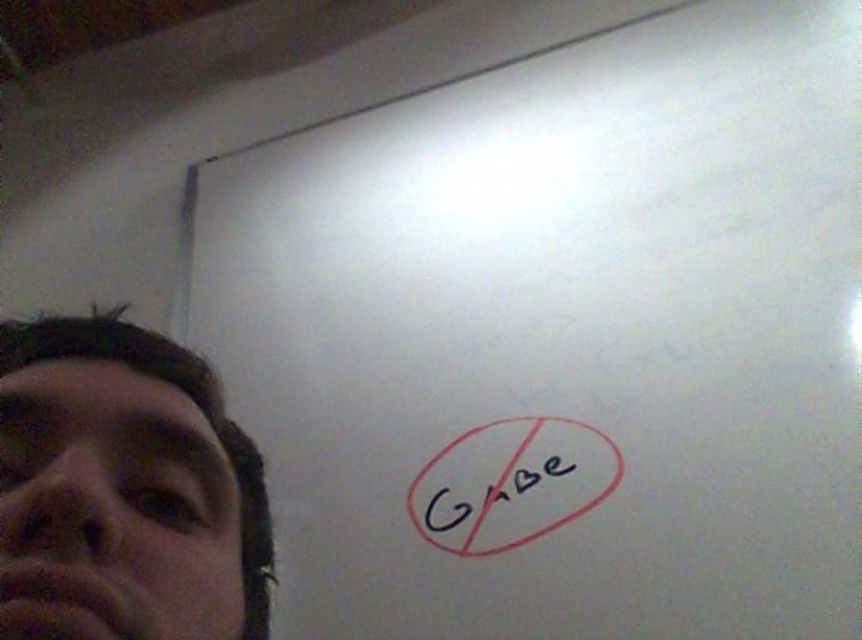
Is black marker at bottom right in front of matte black face at left?

No.

Does black marker at bottom right have a smaller size compared to matte black face at left?

Actually, black marker at bottom right might be larger than matte black face at left.

The width and height of the screenshot is (862, 640). Identify the location of black marker at bottom right. (511, 483).

Based on the photo, does black marker at bottom right appear on the left side of black ink writing at center?

In fact, black marker at bottom right is to the right of black ink writing at center.

Which is behind, point (528, 448) or point (486, 499)?

The point (528, 448) is more distant.

Does point (448, 520) lie in front of point (573, 465)?

No, it is not.

The image size is (862, 640). Find the location of `black marker at bottom right`. black marker at bottom right is located at coordinates (511, 483).

What do you see at coordinates (186, 394) in the screenshot?
I see `matte black face at left` at bounding box center [186, 394].

Is point (139, 353) closer to camera compared to point (428, 509)?

Yes, point (139, 353) is in front of point (428, 509).

What do you see at coordinates (186, 394) in the screenshot? I see `matte black face at left` at bounding box center [186, 394].

This screenshot has width=862, height=640. Identify the location of matte black face at left. 186,394.